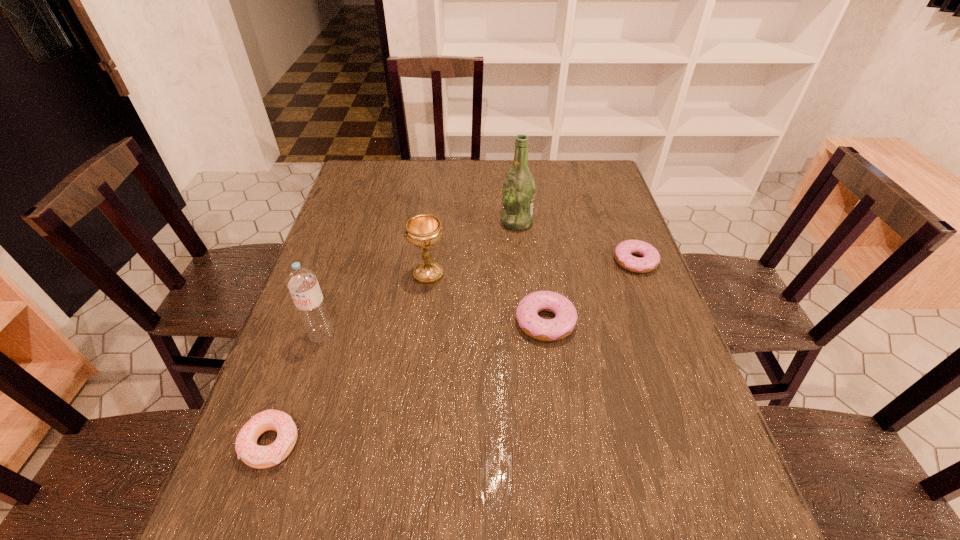
Where is `doughnut at the left edge`? doughnut at the left edge is located at coordinates (256, 456).

Find the location of a particular element. The image size is (960, 540). object located at the right edge is located at coordinates (650, 260).

Find the location of `object that is at the near left corner`. object that is at the near left corner is located at coordinates (256, 456).

Identify the location of vacant space at the far edge. The image size is (960, 540). (484, 172).

Find the location of a particular element. Image resolution: width=960 pixels, height=540 pixels. vacant region at the near edge of the desktop is located at coordinates (550, 447).

You are a GUI agent. You are given a task and a screenshot of the screen. Output one action in this format:
    pyautogui.click(x=<x>, y=<y>)
    Task: Click on the vacant region at the left edge
    
    Given the screenshot: What is the action you would take?
    pyautogui.click(x=365, y=263)

Locate an element on the screen. The height and width of the screenshot is (540, 960). vacant region at the right edge of the desktop is located at coordinates (639, 312).

The image size is (960, 540). Identify the location of free space between the nearest doughnut and the second doughnut from right to left. (408, 382).

Locate an element on the screen. Image resolution: width=960 pixels, height=540 pixels. empty space that is in between the second nearest doughnut and the third tallest object is located at coordinates (487, 298).

Find the location of a particular element. The height and width of the screenshot is (540, 960). unoccupied position between the nearest object and the third object from left to right is located at coordinates (349, 359).